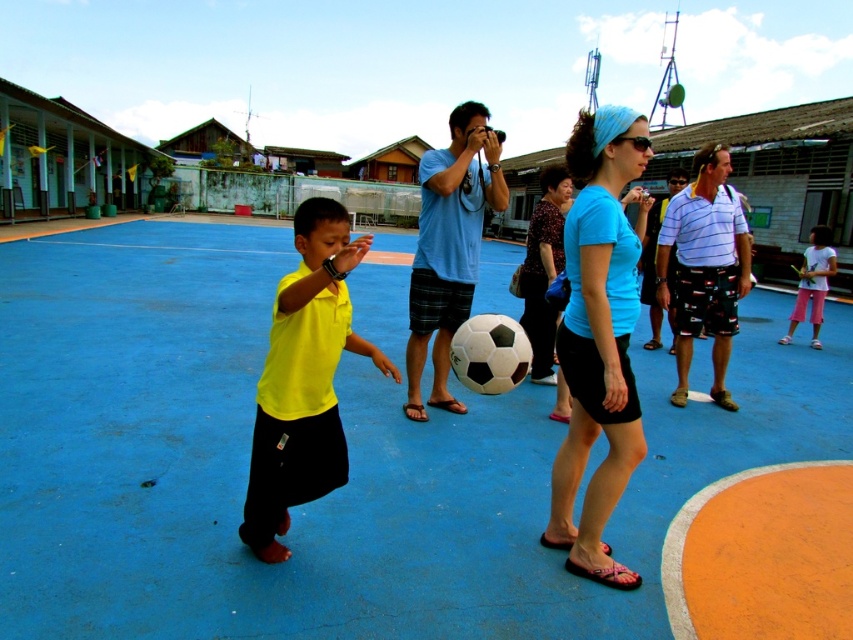
From the picture: Between blue rubber basketball court at center and yellow matte shirt at center, which one has less height?

yellow matte shirt at center

Locate an element on the screen. blue rubber basketball court at center is located at coordinates (347, 456).

From the picture: Who is more forward, [45,516] or [827,291]?

Point [45,516] is in front.

You are a GUI agent. You are given a task and a screenshot of the screen. Output one action in this format:
    pyautogui.click(x=<x>, y=<y>)
    Task: Click on the blue rubber basketball court at center
    Image resolution: width=853 pixels, height=640 pixels.
    Given the screenshot: What is the action you would take?
    pyautogui.click(x=347, y=456)

Does blue rubber basketball court at center have a lesser width compared to light blue t-shirt at center?

No.

Can you confirm if blue rubber basketball court at center is shorter than light blue t-shirt at center?

In fact, blue rubber basketball court at center may be taller than light blue t-shirt at center.

The width and height of the screenshot is (853, 640). Find the location of `blue rubber basketball court at center`. blue rubber basketball court at center is located at coordinates (347, 456).